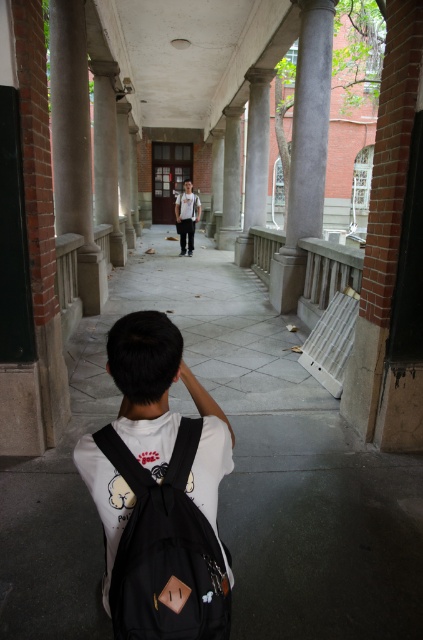
Is point (197, 637) in front of point (308, 216)?

That is True.

Based on the photo, can you confirm if black matte backpack at lower center is positioned above smooth gray column at center?

No.

What are the coordinates of `black matte backpack at lower center` in the screenshot? It's located at (165, 548).

Which is more to the left, black matte backpack at lower center or white cotton shirt at center?

From the viewer's perspective, white cotton shirt at center appears more on the left side.

Looking at this image, between black matte backpack at lower center and white cotton shirt at center, which one is positioned higher?

white cotton shirt at center is higher up.

This screenshot has height=640, width=423. I want to click on black matte backpack at lower center, so click(x=165, y=548).

Which is behind, point (282, 298) or point (181, 204)?

The point (181, 204) is more distant.

Can you confirm if smooth gray column at center is wider than white cotton shirt at center?

Indeed, smooth gray column at center has a greater width compared to white cotton shirt at center.

Between point (318, 150) and point (184, 216), which one is positioned behind?

Positioned behind is point (184, 216).

You are a GUI agent. You are given a task and a screenshot of the screen. Output one action in this format:
    pyautogui.click(x=<x>, y=<y>)
    Task: Click on the smooth gray column at center
    This screenshot has width=423, height=640.
    Given the screenshot: What is the action you would take?
    pyautogui.click(x=305, y=150)